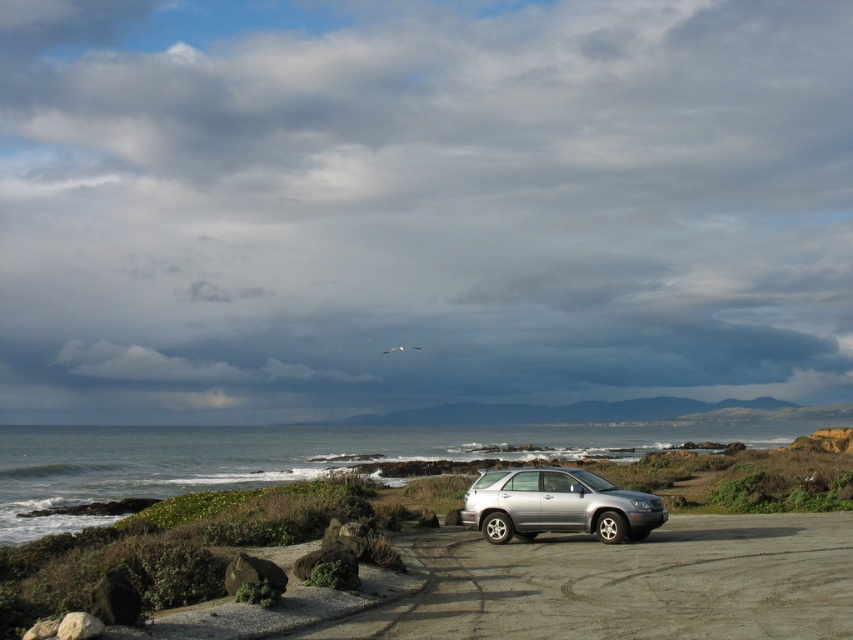
You are a photographer trying to capture both the silver metallic suv at center and the satin silver suv at center in a single shot. Since you can only focus on one vehicle at a time, which one should you focus on to ensure the other remains in the background?

You should focus on the silver metallic suv at center because it is positioned under the satin silver suv at center, meaning the satin silver suv at center will naturally be in the background.

You are a photographer trying to capture both the silver metallic suv at center and the satin silver suv at center in a single shot. Based on their positions, which suv should you position your camera closer to in order to include both vehicles without zooming out?

You should position your camera closer to the satin silver suv at center because the silver metallic suv at center is to the left of it, so moving closer to the one on the right allows both to be framed without zooming out.

You are a photographer setting up equipment in the gravel parking area. You have two silver SUVs in front of you. Which one is closer to you, the silver metallic suv at center or the satin silver suv at center?

The silver metallic suv at center is closer to you because it is positioned in front of the satin silver suv at center.